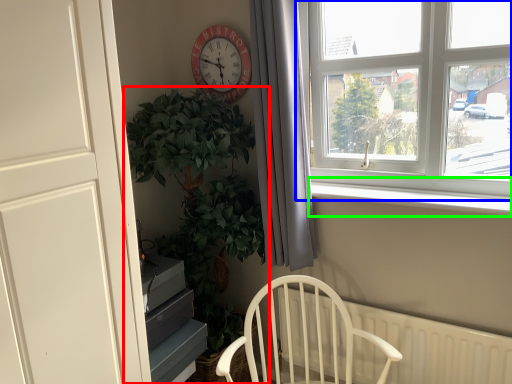
Question: Considering the real-world distances, which object is farthest from houseplant (highlighted by a red box)? window (highlighted by a blue box) or window sill (highlighted by a green box)?

Choices:
 (A) window
 (B) window sill

Answer: (A)